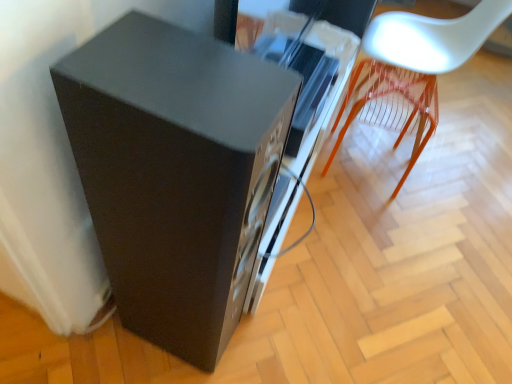
Question: Is matte black speaker at lower left closer to the viewer compared to white plastic chair at upper right?

Choices:
 (A) yes
 (B) no

Answer: (A)

Question: Is matte black speaker at lower left looking in the opposite direction of white plastic chair at upper right?

Choices:
 (A) no
 (B) yes

Answer: (A)

Question: Is matte black speaker at lower left in contact with white plastic chair at upper right?

Choices:
 (A) no
 (B) yes

Answer: (A)

Question: From a real-world perspective, is matte black speaker at lower left beneath white plastic chair at upper right?

Choices:
 (A) yes
 (B) no

Answer: (B)

Question: Does matte black speaker at lower left turn towards white plastic chair at upper right?

Choices:
 (A) no
 (B) yes

Answer: (A)

Question: Considering the relative sizes of matte black speaker at lower left and white plastic chair at upper right in the image provided, is matte black speaker at lower left smaller than white plastic chair at upper right?

Choices:
 (A) yes
 (B) no

Answer: (A)

Question: Is white plastic chair at upper right directly adjacent to matte black speaker at lower left?

Choices:
 (A) no
 (B) yes

Answer: (A)

Question: Is white plastic chair at upper right thinner than matte black speaker at lower left?

Choices:
 (A) no
 (B) yes

Answer: (A)

Question: Can you confirm if white plastic chair at upper right is taller than matte black speaker at lower left?

Choices:
 (A) no
 (B) yes

Answer: (A)

Question: Considering the relative positions of white plastic chair at upper right and matte black speaker at lower left in the image provided, is white plastic chair at upper right behind matte black speaker at lower left?

Choices:
 (A) yes
 (B) no

Answer: (A)

Question: Is white plastic chair at upper right facing away from matte black speaker at lower left?

Choices:
 (A) no
 (B) yes

Answer: (A)

Question: Is white plastic chair at upper right shorter than matte black speaker at lower left?

Choices:
 (A) yes
 (B) no

Answer: (A)

Question: In terms of width, does white plastic chair at upper right look wider or thinner when compared to matte black speaker at lower left?

Choices:
 (A) wide
 (B) thin

Answer: (A)